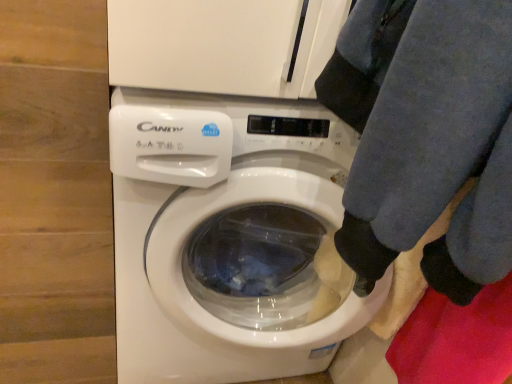
Question: Considering the relative sizes of white glossy washing machine at center and blue fleece pants at lower right in the image provided, is white glossy washing machine at center thinner than blue fleece pants at lower right?

Choices:
 (A) no
 (B) yes

Answer: (A)

Question: Does white glossy washing machine at center have a larger size compared to blue fleece pants at lower right?

Choices:
 (A) no
 (B) yes

Answer: (B)

Question: Is white glossy washing machine at center looking in the opposite direction of blue fleece pants at lower right?

Choices:
 (A) no
 (B) yes

Answer: (A)

Question: Is the depth of white glossy washing machine at center less than that of blue fleece pants at lower right?

Choices:
 (A) yes
 (B) no

Answer: (B)

Question: Is white glossy washing machine at center located outside blue fleece pants at lower right?

Choices:
 (A) yes
 (B) no

Answer: (A)

Question: Can you confirm if white glossy washing machine at center is wider than blue fleece pants at lower right?

Choices:
 (A) no
 (B) yes

Answer: (B)

Question: Is blue fleece pants at lower right outside white glossy washing machine at center?

Choices:
 (A) yes
 (B) no

Answer: (A)

Question: Is blue fleece pants at lower right positioned far away from white glossy washing machine at center?

Choices:
 (A) yes
 (B) no

Answer: (B)

Question: Is blue fleece pants at lower right positioned with its back to white glossy washing machine at center?

Choices:
 (A) yes
 (B) no

Answer: (B)

Question: From a real-world perspective, is blue fleece pants at lower right under white glossy washing machine at center?

Choices:
 (A) no
 (B) yes

Answer: (A)

Question: From a real-world perspective, is blue fleece pants at lower right positioned over white glossy washing machine at center based on gravity?

Choices:
 (A) no
 (B) yes

Answer: (B)

Question: Does blue fleece pants at lower right appear on the right side of white glossy washing machine at center?

Choices:
 (A) yes
 (B) no

Answer: (A)

Question: From a real-world perspective, is blue fleece pants at lower right above or below white glossy washing machine at center?

Choices:
 (A) above
 (B) below

Answer: (A)